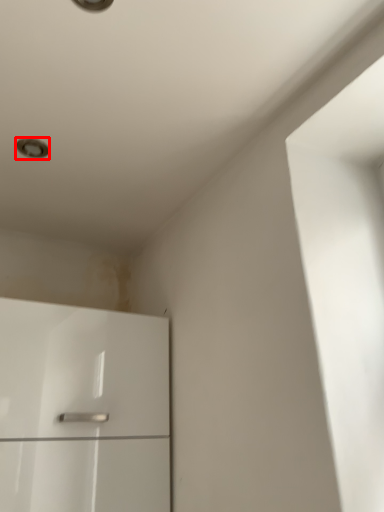
Question: From the image's perspective, considering the relative positions of dot (annotated by the red box) and cabinetry in the image provided, where is dot (annotated by the red box) located with respect to the staircase?

Choices:
 (A) above
 (B) below

Answer: (A)